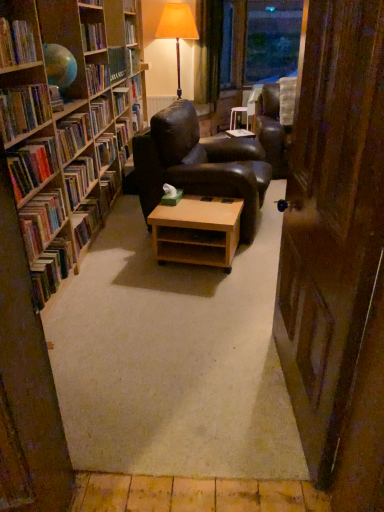
Identify the location of free space above light brown wooden table at center (from a real-world perspective). (203, 207).